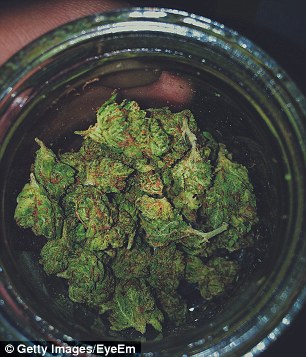
Locate an element on the screen. This screenshot has height=357, width=306. table is located at coordinates (24, 30).